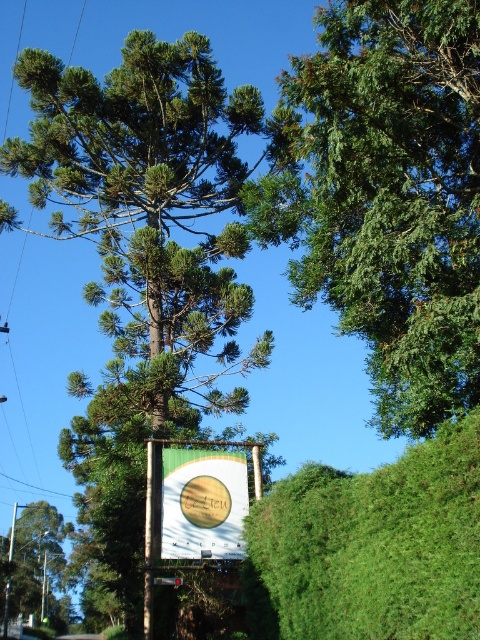
You are planning to place a small birdhouse that is 1 meter wide in the garden. Looking at the image, which object between the green leafy hedge at lower right and the green fabric sign at center can accommodate the birdhouse without overlapping?

The green leafy hedge at lower right is larger in size than the green fabric sign at center, so the birdhouse can be placed near the green leafy hedge at lower right as it has more space.

You are standing at the point with coordinates point (194, 522) and want to walk towards the signboard. Is the point point (408, 577) blocking your path? Please explain your reasoning.

Point (408, 577) is in front of point (194, 522), so it is blocking the path towards the signboard. Therefore, you would need to navigate around it to reach the signboard.